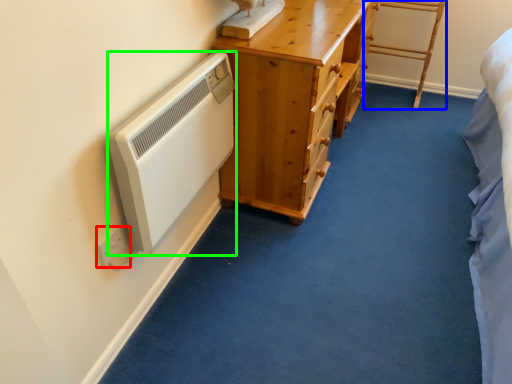
Question: Which object is positioned closest to electric outlet (highlighted by a red box)? Select from furniture (highlighted by a blue box) and appliance (highlighted by a green box).

Choices:
 (A) furniture
 (B) appliance

Answer: (B)